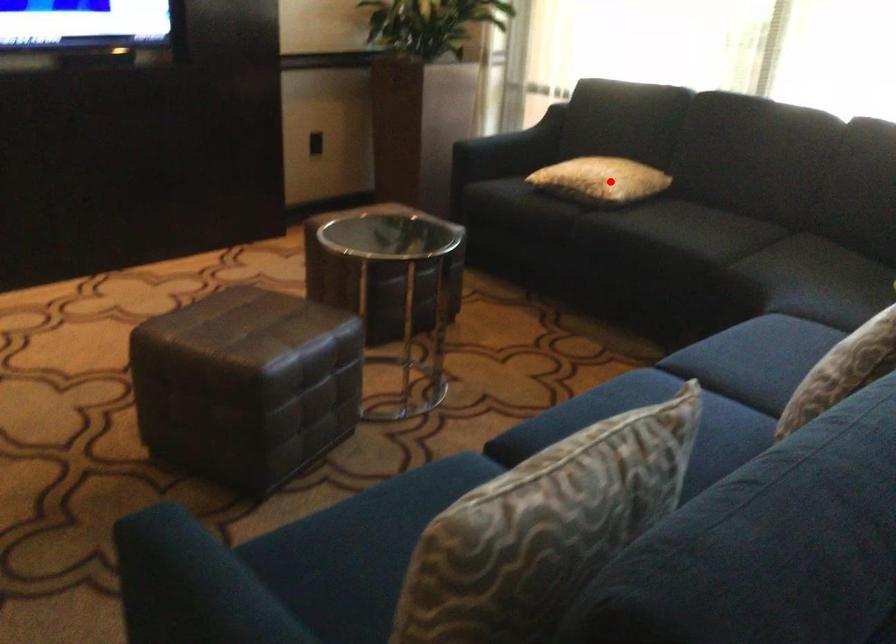
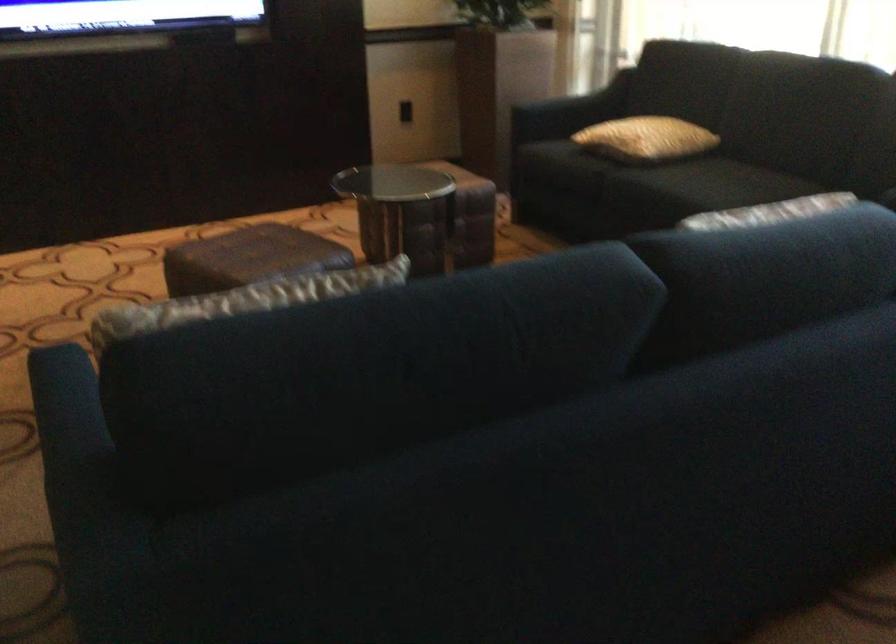
In the second image, find the point that corresponds to the highlighted location in the first image.

(645, 138)